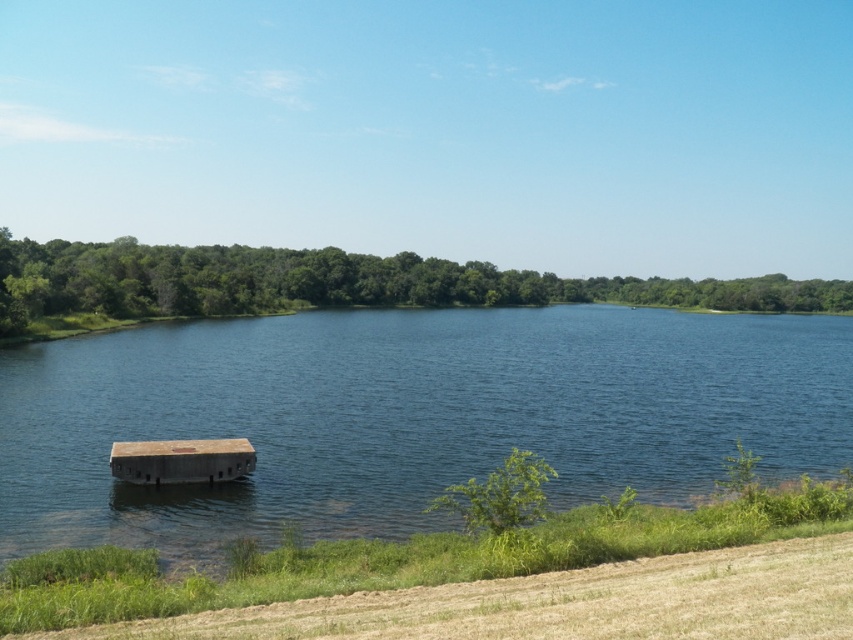
You are standing on the brown wooden dock at center and want to reach the clear blue water at center. Is the dock submerged in the water at that point?

The clear blue water at center is positioned over the brown wooden dock at center, meaning the dock is submerged in the water at that point. Yes, the dock is submerged there.

You are a kayaker planning to paddle from the clear blue water at center to the brown wooden dock at center. Given that your kayak can only handle calm waters up to 150 feet away, will you be able to safely reach the dock?

The distance between the clear blue water at center and the brown wooden dock at center is 147.25 feet, which is within the kayak can handle calm waters up to 150 feet away. Therefore, you can safely reach the dock.